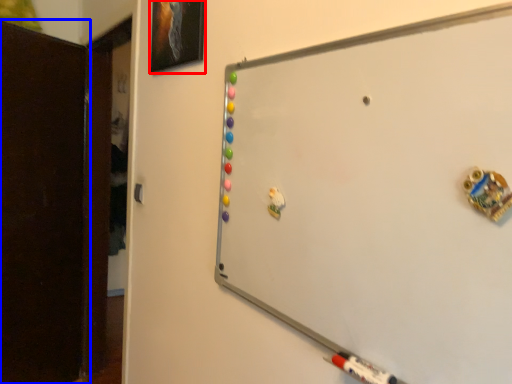
Question: Which of the following is the farthest to the observer, picture frame (highlighted by a red box) or door (highlighted by a blue box)?

Choices:
 (A) picture frame
 (B) door

Answer: (B)